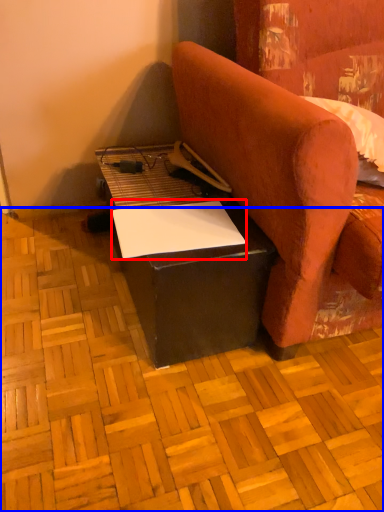
Question: Among these objects, which one is farthest to the camera, notepad (highlighted by a red box) or plywood (highlighted by a blue box)?

Choices:
 (A) notepad
 (B) plywood

Answer: (A)